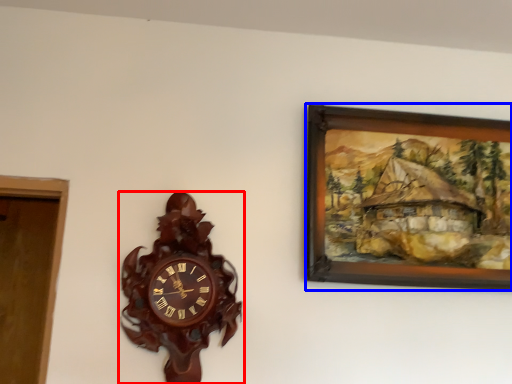
Question: Which object appears closest to the camera in this image, wall clock (highlighted by a red box) or picture frame (highlighted by a blue box)?

Choices:
 (A) wall clock
 (B) picture frame

Answer: (A)